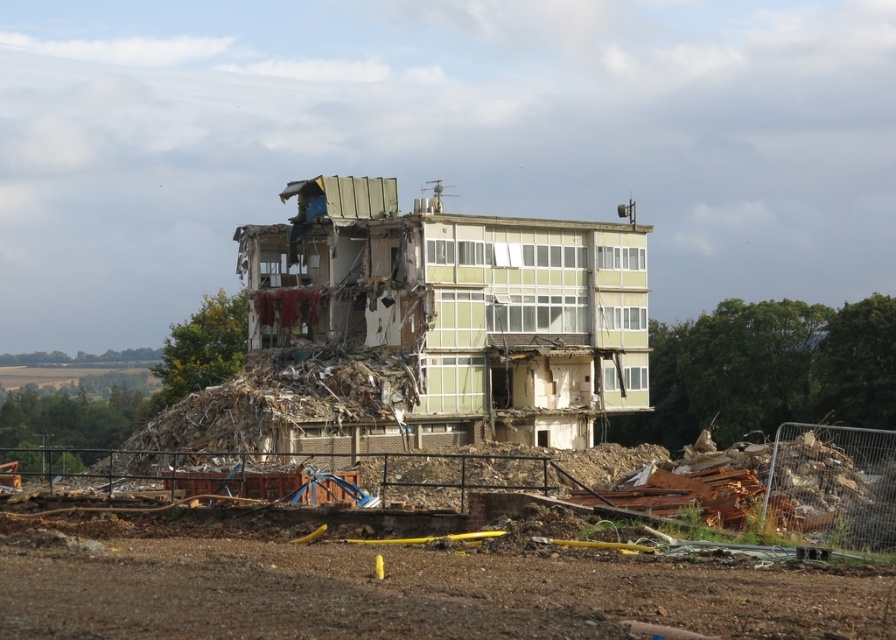
Can you confirm if green concrete building at center is positioned to the right of green glass building at center?

Indeed, green concrete building at center is positioned on the right side of green glass building at center.

Does point (554, 326) come behind point (625, 227)?

No, (554, 326) is in front of (625, 227).

Is point (803, 580) closer to camera compared to point (567, 275)?

That is True.

Identify the location of green concrete building at center. (403, 348).

Does green concrete building at center have a larger size compared to rusty metal debris at center?

Correct, green concrete building at center is larger in size than rusty metal debris at center.

From the picture: How much distance is there between green concrete building at center and rusty metal debris at center?

A distance of 10.54 meters exists between green concrete building at center and rusty metal debris at center.

Where is `green concrete building at center`? Image resolution: width=896 pixels, height=640 pixels. green concrete building at center is located at coordinates (403, 348).

The image size is (896, 640). I want to click on rusty metal debris at center, so click(x=402, y=582).

Between rusty metal debris at center and green glass building at center, which one is positioned higher?

green glass building at center is above.

From the picture: Who is more forward, (170, 586) or (351, 298)?

Point (170, 586) is more forward.

Find the location of a particular element. rusty metal debris at center is located at coordinates (402, 582).